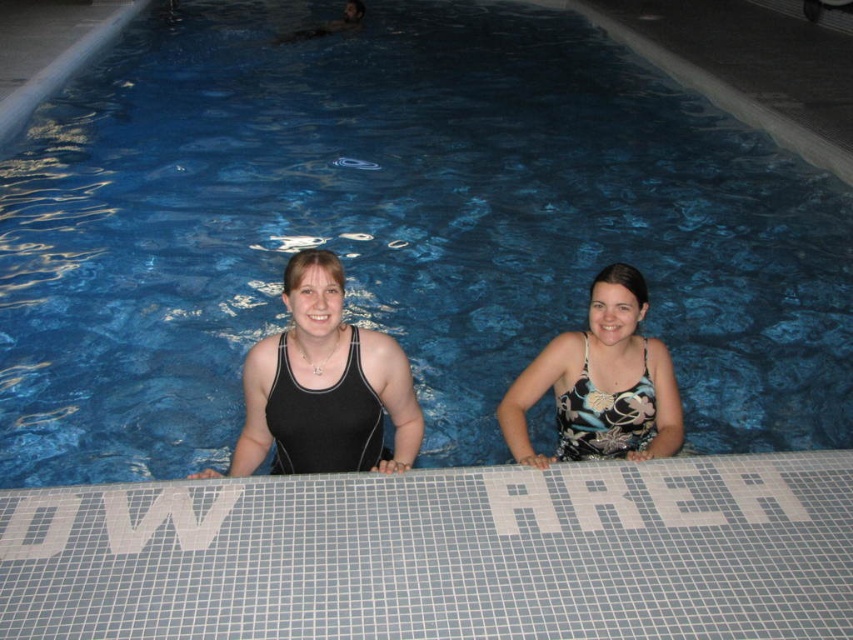
I want to click on black matte swimsuit at center, so click(323, 385).

Between point (341, 412) and point (604, 424), which one is positioned behind?

Positioned behind is point (604, 424).

Where is `black matte swimsuit at center`? Image resolution: width=853 pixels, height=640 pixels. black matte swimsuit at center is located at coordinates (323, 385).